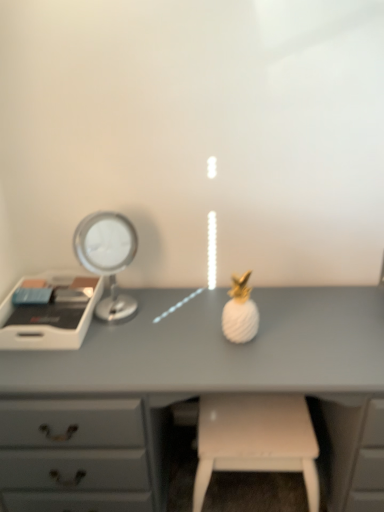
Question: Can you confirm if silver metallic mirror at left is shorter than white matte stool at lower center?

Choices:
 (A) yes
 (B) no

Answer: (A)

Question: Is silver metallic mirror at left to the right of white matte stool at lower center from the viewer's perspective?

Choices:
 (A) no
 (B) yes

Answer: (A)

Question: Could you tell me if silver metallic mirror at left is turned towards white matte stool at lower center?

Choices:
 (A) no
 (B) yes

Answer: (A)

Question: Is silver metallic mirror at left turned away from white matte stool at lower center?

Choices:
 (A) no
 (B) yes

Answer: (A)

Question: Is silver metallic mirror at left wider than white matte stool at lower center?

Choices:
 (A) no
 (B) yes

Answer: (A)

Question: Is white plastic tray at left wider or thinner than silver metallic mirror at left?

Choices:
 (A) thin
 (B) wide

Answer: (B)

Question: From their relative heights in the image, would you say white plastic tray at left is taller or shorter than silver metallic mirror at left?

Choices:
 (A) short
 (B) tall

Answer: (A)

Question: Based on their positions, is white plastic tray at left located to the left or right of silver metallic mirror at left?

Choices:
 (A) right
 (B) left

Answer: (B)

Question: Relative to silver metallic mirror at left, is white plastic tray at left in front or behind?

Choices:
 (A) front
 (B) behind

Answer: (B)

Question: Considering the positions of matte gray desk at center and white plastic tray at left in the image, is matte gray desk at center taller or shorter than white plastic tray at left?

Choices:
 (A) short
 (B) tall

Answer: (B)

Question: From a real-world perspective, relative to white plastic tray at left, is matte gray desk at center vertically above or below?

Choices:
 (A) below
 (B) above

Answer: (A)

Question: Is matte gray desk at center wider or thinner than white plastic tray at left?

Choices:
 (A) wide
 (B) thin

Answer: (A)

Question: Does point (8, 415) appear closer or farther from the camera than point (51, 280)?

Choices:
 (A) farther
 (B) closer

Answer: (B)

Question: In terms of height, does matte gray desk at center look taller or shorter compared to white matte stool at lower center?

Choices:
 (A) tall
 (B) short

Answer: (A)

Question: Would you say matte gray desk at center is to the left or to the right of white matte stool at lower center in the picture?

Choices:
 (A) right
 (B) left

Answer: (B)